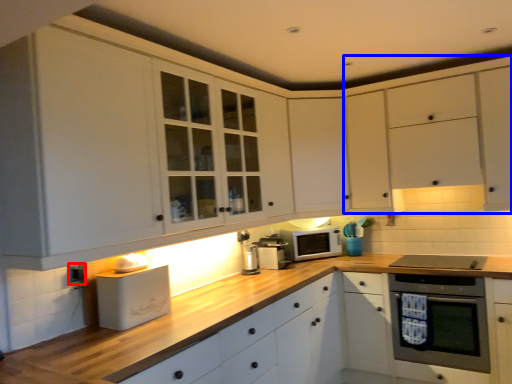
Question: Among these objects, which one is nearest to the camera, electric outlet (highlighted by a red box) or cabinetry (highlighted by a blue box)?

Choices:
 (A) electric outlet
 (B) cabinetry

Answer: (A)